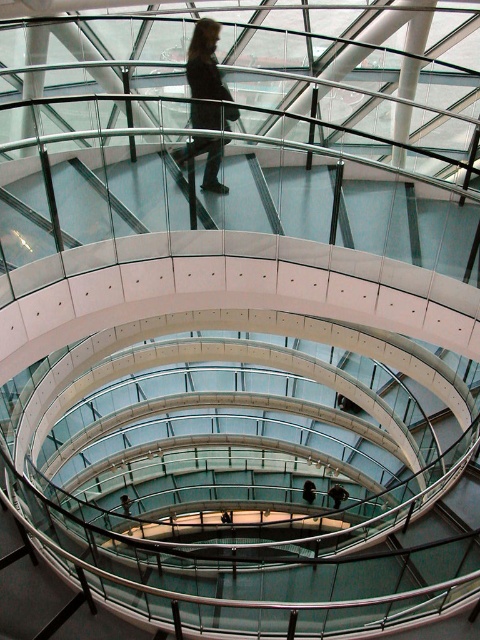
Question: Does dark brown leather jacket at center have a lesser width compared to dark brown leather jacket at upper center?

Choices:
 (A) no
 (B) yes

Answer: (B)

Question: Is dark brown leather jacket at center positioned at the back of dark brown leather jacket at upper center?

Choices:
 (A) no
 (B) yes

Answer: (A)

Question: Which point is closer to the camera taking this photo?

Choices:
 (A) (337, 500)
 (B) (208, 33)

Answer: (B)

Question: Does dark brown leather jacket at center have a greater width compared to dark brown leather jacket at upper center?

Choices:
 (A) no
 (B) yes

Answer: (A)

Question: Which point is farther to the camera?

Choices:
 (A) dark brown leather jacket at center
 (B) dark brown leather jacket at upper center

Answer: (B)

Question: Which of the following is the closest to the observer?

Choices:
 (A) dark brown leather jacket at center
 (B) dark brown leather jacket at upper center

Answer: (A)